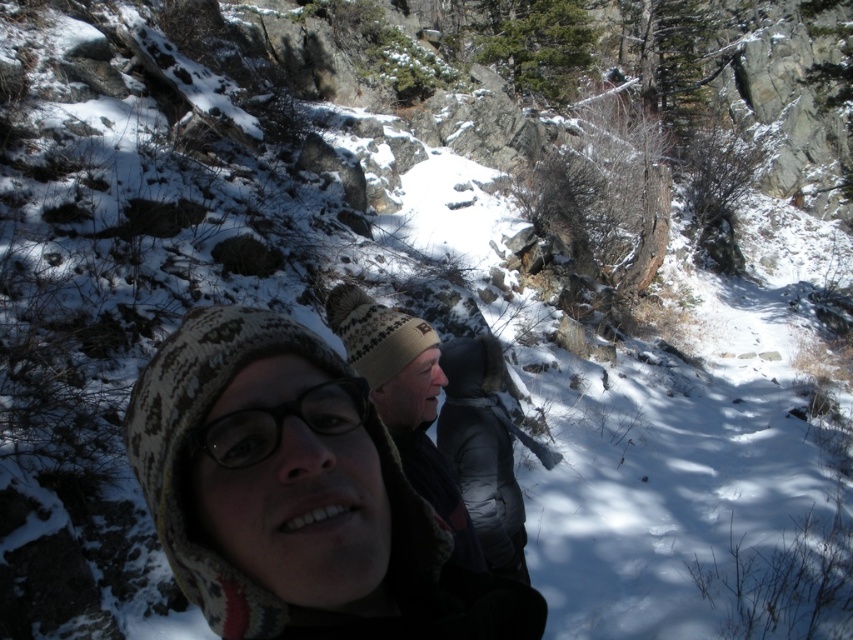
In the scene shown: Is knitted wool hat at center further to camera compared to black matte glasses at center?

No, it is not.

Can you confirm if knitted wool hat at center is wider than black matte glasses at center?

Indeed, knitted wool hat at center has a greater width compared to black matte glasses at center.

Which is behind, point (310, 512) or point (230, 452)?

Point (230, 452)

Locate an element on the screen. This screenshot has width=853, height=640. knitted wool hat at center is located at coordinates (294, 493).